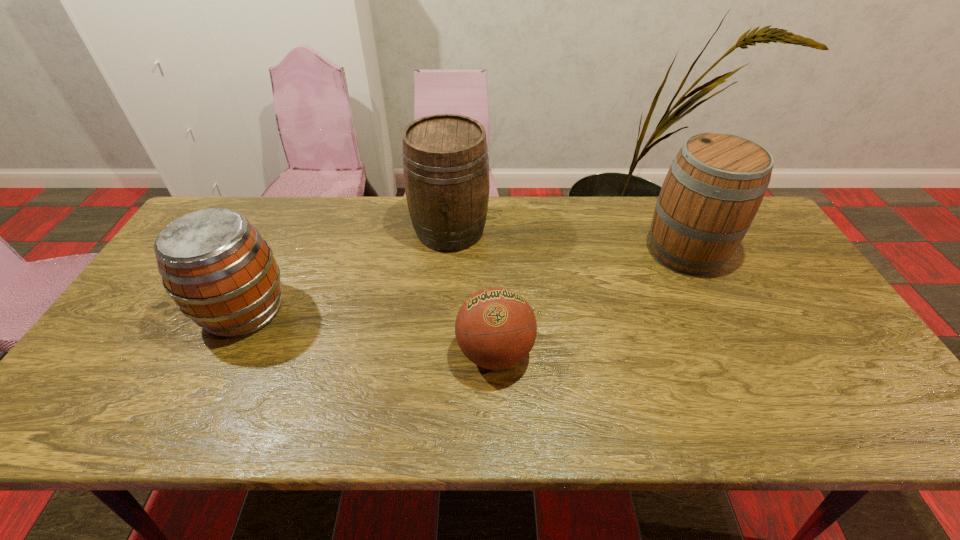
Where is `free area in between the second shortest object and the rightmost cider`? free area in between the second shortest object and the rightmost cider is located at coordinates (465, 281).

You are a GUI agent. You are given a task and a screenshot of the screen. Output one action in this format:
    pyautogui.click(x=<x>, y=<y>)
    Task: Click on the unoccupied area between the rightmost object and the basketball
    The image size is (960, 540).
    Given the screenshot: What is the action you would take?
    590,302

Identify the location of vacant space that is in between the second cider from left to right and the basketball. (472, 292).

The image size is (960, 540). Identify the location of vacant space that is in between the rightmost cider and the second cider from right to left. [x=567, y=241].

What are the coordinates of `vacant space that is in between the second cider from right to left and the rightmost object` in the screenshot? It's located at (567, 241).

The image size is (960, 540). I want to click on object that ranks as the third closest to the rightmost cider, so click(220, 272).

The image size is (960, 540). I want to click on the third closest object to the rightmost cider, so click(220, 272).

Locate which cider is the closest to the second cider from right to left. Please provide its 2D coordinates. Your answer should be formatted as a tuple, i.e. [(x, y)], where the tuple contains the x and y coordinates of a point satisfying the conditions above.

[(220, 272)]

Identify which cider is located as the nearest to the shortest object. Please provide its 2D coordinates. Your answer should be formatted as a tuple, i.e. [(x, y)], where the tuple contains the x and y coordinates of a point satisfying the conditions above.

[(445, 156)]

Where is `vacant point that satisfies the following two spatial constraints: 1. on the back side of the rightmost cider; 2. on the right side of the shortest object`? The height and width of the screenshot is (540, 960). vacant point that satisfies the following two spatial constraints: 1. on the back side of the rightmost cider; 2. on the right side of the shortest object is located at coordinates (492, 252).